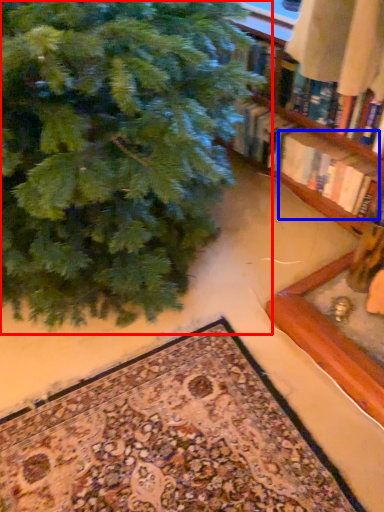
Question: Among these objects, which one is farthest to the camera, christmas tree (highlighted by a red box) or book (highlighted by a blue box)?

Choices:
 (A) christmas tree
 (B) book

Answer: (B)